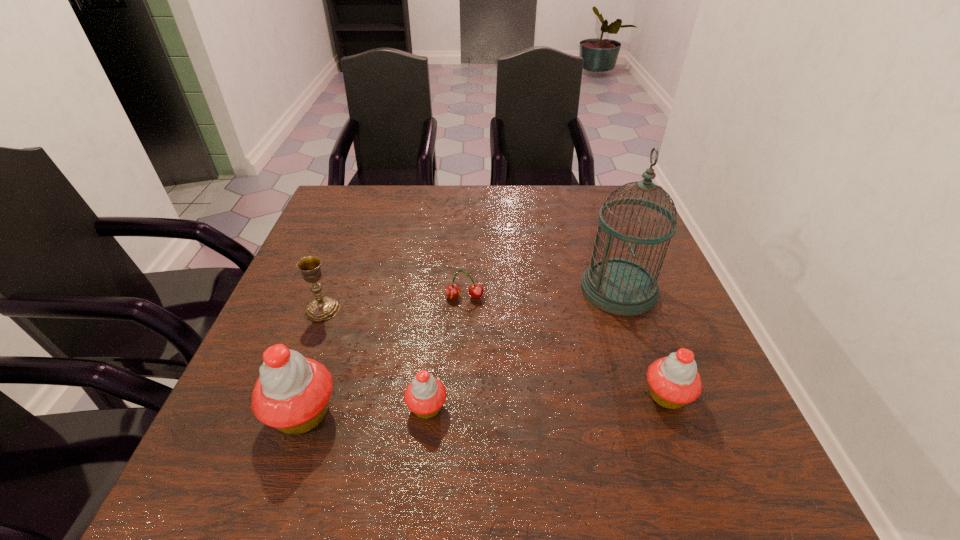
Identify the location of vacant area that lies between the chalice and the cherry. (394, 303).

This screenshot has width=960, height=540. What are the coordinates of `empty location between the tallest cupcake and the shortest cupcake` in the screenshot? It's located at (365, 410).

Where is `vacant area between the chalice and the tallest object`? This screenshot has height=540, width=960. vacant area between the chalice and the tallest object is located at coordinates (470, 300).

Image resolution: width=960 pixels, height=540 pixels. I want to click on empty space between the tallest cupcake and the tallest object, so click(x=461, y=351).

This screenshot has width=960, height=540. Identify the location of free area in between the second cupcake from left to right and the chalice. (374, 359).

The image size is (960, 540). In order to click on free space between the leftmost cupcake and the cherry in this screenshot , I will do `click(384, 355)`.

At what (x,y) coordinates should I click in order to perform the action: click on vacant area between the leftmost cupcake and the shortest object. Please return your answer as a coordinate pair (x, y). The image size is (960, 540). Looking at the image, I should click on (384, 355).

You are a GUI agent. You are given a task and a screenshot of the screen. Output one action in this format:
    pyautogui.click(x=<x>, y=<y>)
    Task: Click on the object that is the closest one to the tallest cupcake
    
    Given the screenshot: What is the action you would take?
    pyautogui.click(x=425, y=395)

Identify which object is the nearest to the birdcage. Please provide its 2D coordinates. Your answer should be formatted as a tuple, i.e. [(x, y)], where the tuple contains the x and y coordinates of a point satisfying the conditions above.

[(674, 381)]

You are a GUI agent. You are given a task and a screenshot of the screen. Output one action in this format:
    pyautogui.click(x=<x>, y=<y>)
    Task: Click on the cupcake that stands as the third closest to the cherry
    
    Given the screenshot: What is the action you would take?
    pyautogui.click(x=674, y=381)